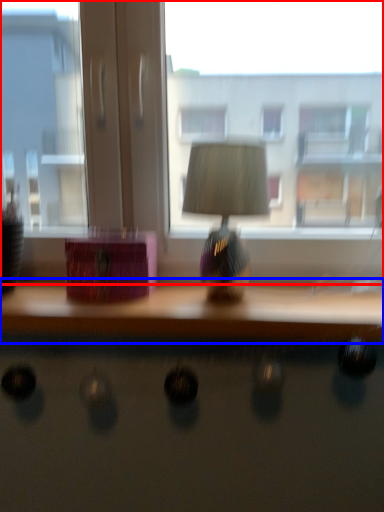
Question: Which point is closer to the camera, window (highlighted by a red box) or table (highlighted by a blue box)?

Choices:
 (A) window
 (B) table

Answer: (B)